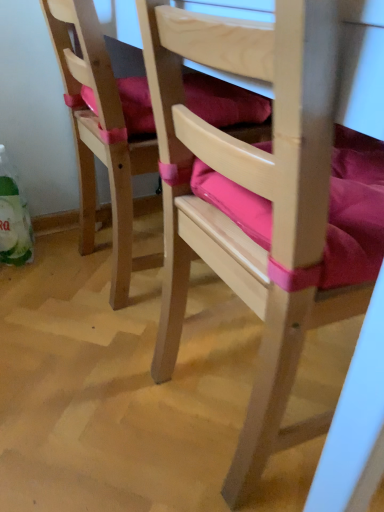
Locate an element on the screen. unoccupied area in front of pink fabric cushion at left, which is the 1th chair in left-to-right order is located at coordinates (94, 344).